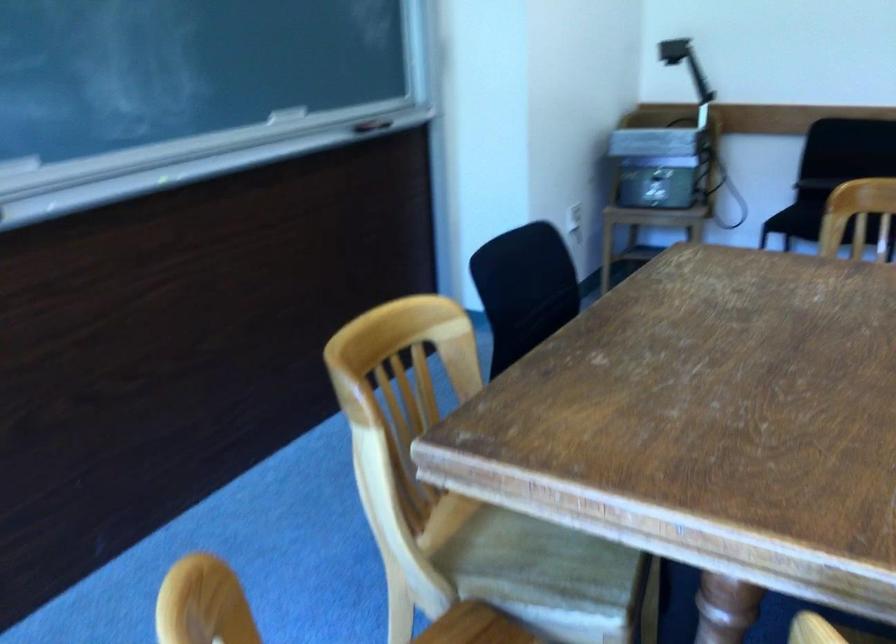
Where would you rotat the projector head? Please return your answer as a coordinate pair (x, y).

(659, 166)